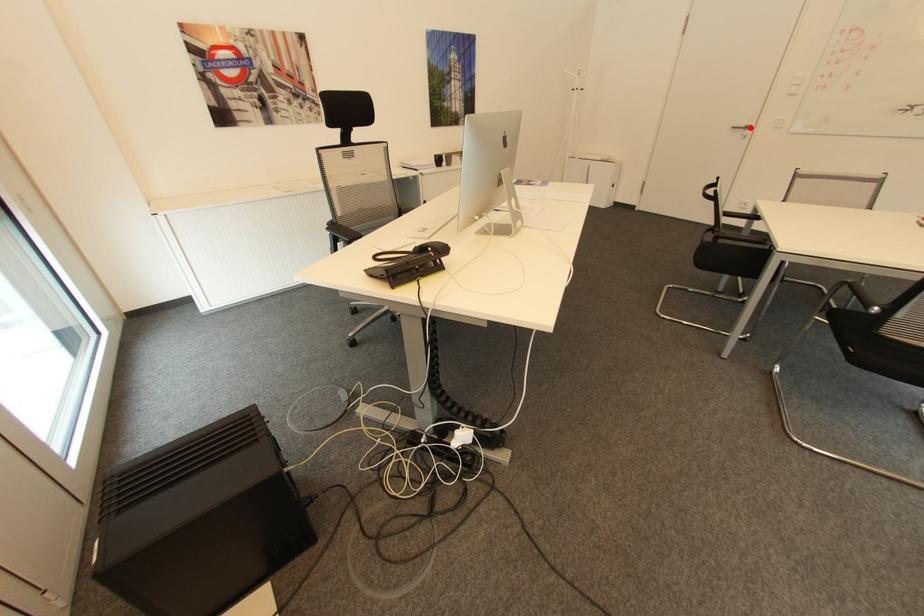
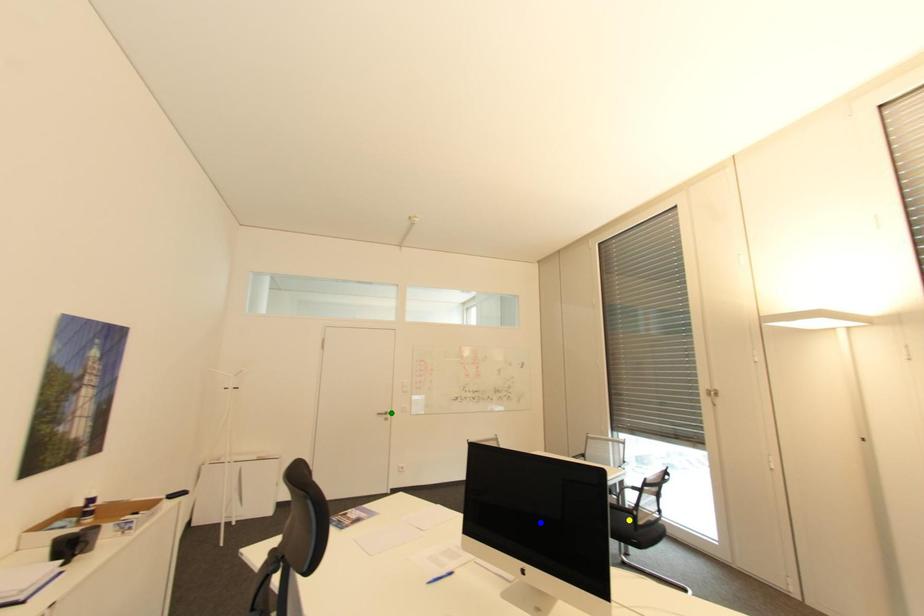
Question: I am providing you with two images of the same scene from different viewpoints. A red point is marked on the first image. You are given multiple points on the second image. Which point in image 2 represents the same 3d spot as the red point in image 1?

Choices:
 (A) yellow point
 (B) green point
 (C) blue point

Answer: (B)